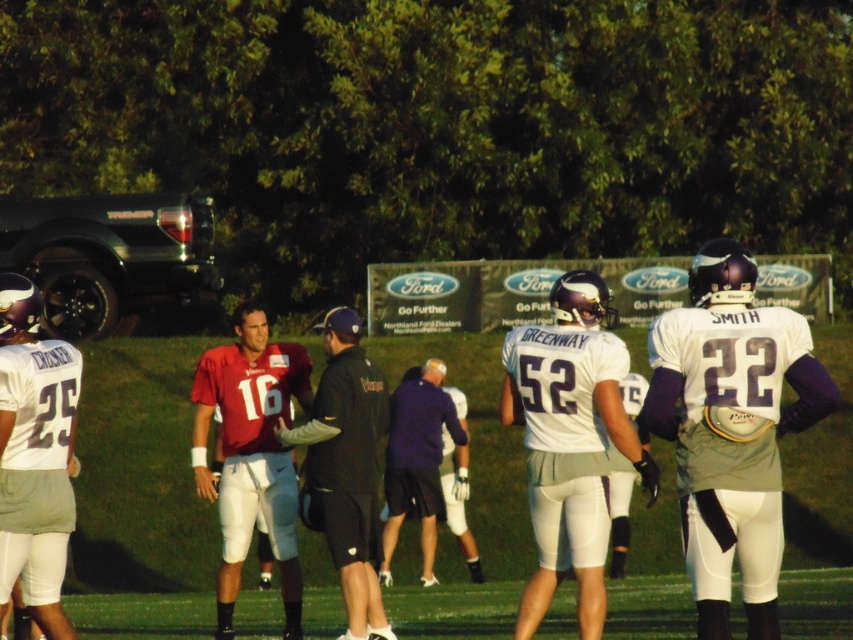
Question: Does matte red jersey at center have a lesser width compared to purple fabric shirt at center?

Choices:
 (A) yes
 (B) no

Answer: (A)

Question: Which point appears closest to the camera in this image?

Choices:
 (A) (740, 333)
 (B) (334, 403)

Answer: (A)

Question: Estimate the real-world distances between objects in this image. Which object is farther from the white matte jersey at left?

Choices:
 (A) dark blue uniform at center
 (B) matte red jersey at center

Answer: (B)

Question: Considering the real-world distances, which object is closest to the white matte uniform at center?

Choices:
 (A) dark blue uniform at center
 (B) matte red jersey at center
 (C) purple fabric shirt at center
 (D) white matte jersey at right

Answer: (D)

Question: Is white matte jersey at right closer to the viewer compared to purple fabric shirt at center?

Choices:
 (A) no
 (B) yes

Answer: (B)

Question: Is white matte jersey at right positioned at the back of dark blue uniform at center?

Choices:
 (A) yes
 (B) no

Answer: (B)